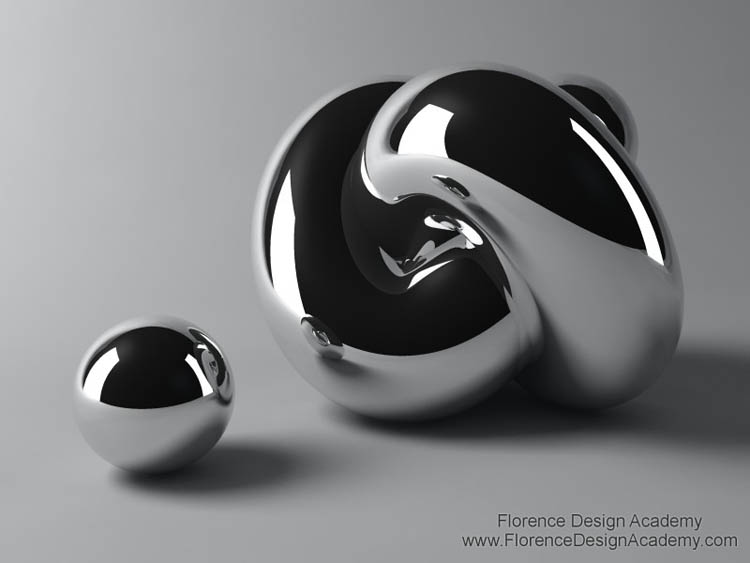
Identify the location of shadow under artistic chrome ball. (512, 402).